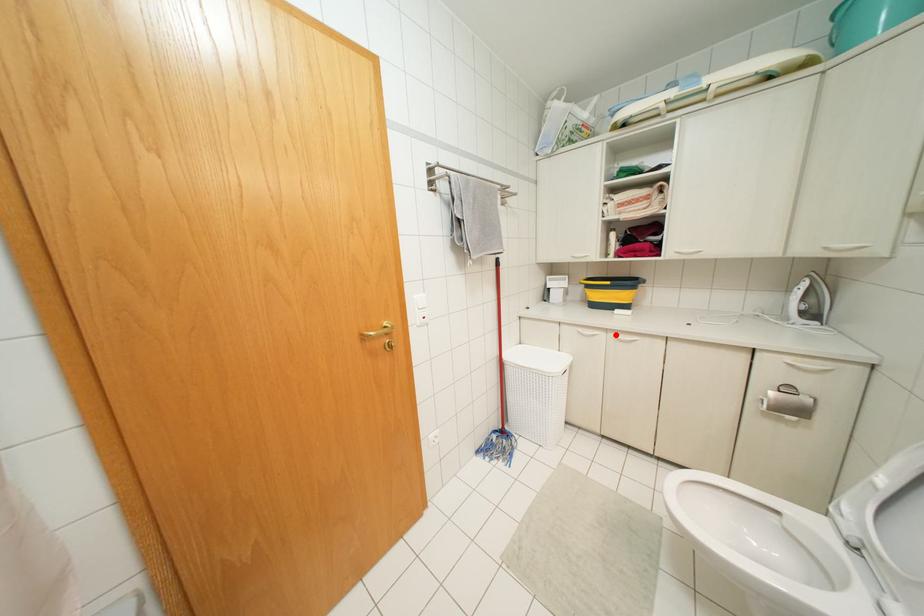
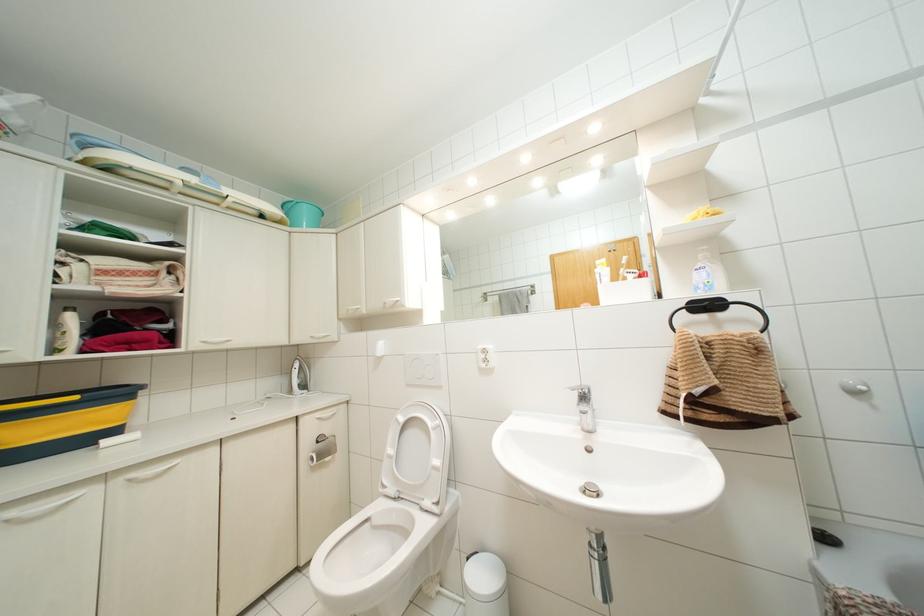
In the second image, find the point that corresponds to the highlighted location in the first image.

(132, 475)